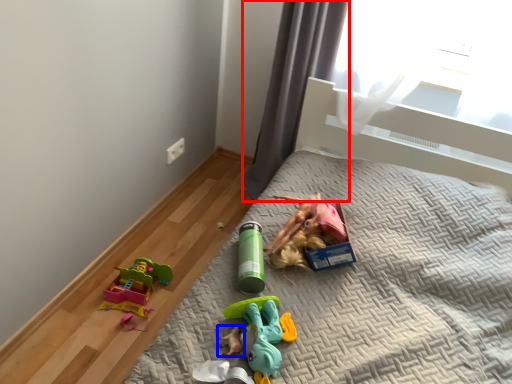
Question: Among these objects, which one is nearest to the camera, curtain (highlighted by a red box) or toy (highlighted by a blue box)?

Choices:
 (A) curtain
 (B) toy

Answer: (B)